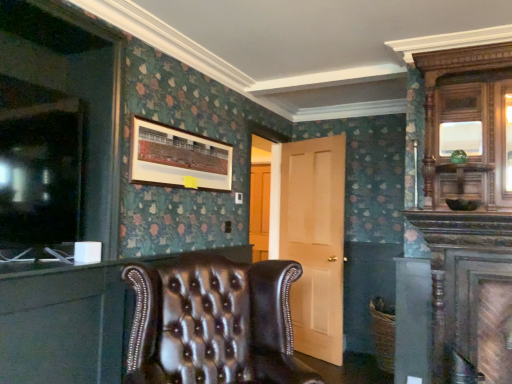
Question: Is the position of leather tufted chair at lower left less distant than that of leather tufted chair at center?

Choices:
 (A) no
 (B) yes

Answer: (A)

Question: Is leather tufted chair at lower left further to camera compared to leather tufted chair at center?

Choices:
 (A) yes
 (B) no

Answer: (A)

Question: Considering the relative sizes of leather tufted chair at lower left and leather tufted chair at center in the image provided, is leather tufted chair at lower left wider than leather tufted chair at center?

Choices:
 (A) yes
 (B) no

Answer: (B)

Question: Can you confirm if leather tufted chair at lower left is taller than leather tufted chair at center?

Choices:
 (A) yes
 (B) no

Answer: (B)

Question: Are leather tufted chair at lower left and leather tufted chair at center far apart?

Choices:
 (A) no
 (B) yes

Answer: (A)

Question: From a real-world perspective, is matte wooden picture frame at upper center above or below light wood door at center?

Choices:
 (A) below
 (B) above

Answer: (B)

Question: Is matte wooden picture frame at upper center inside the boundaries of light wood door at center, or outside?

Choices:
 (A) inside
 (B) outside

Answer: (B)

Question: Relative to light wood door at center, is matte wooden picture frame at upper center in front or behind?

Choices:
 (A) front
 (B) behind

Answer: (A)

Question: In terms of size, does matte wooden picture frame at upper center appear bigger or smaller than light wood door at center?

Choices:
 (A) small
 (B) big

Answer: (A)

Question: From a real-world perspective, is polished wood armoire at upper right physically located above or below leather tufted chair at center?

Choices:
 (A) below
 (B) above

Answer: (B)

Question: Considering the positions of polished wood armoire at upper right and leather tufted chair at center in the image, is polished wood armoire at upper right taller or shorter than leather tufted chair at center?

Choices:
 (A) short
 (B) tall

Answer: (B)

Question: From the image's perspective, is polished wood armoire at upper right located above or below leather tufted chair at center?

Choices:
 (A) above
 (B) below

Answer: (A)

Question: Would you say polished wood armoire at upper right is to the left or to the right of leather tufted chair at center in the picture?

Choices:
 (A) left
 (B) right

Answer: (B)

Question: Do you think matte wooden picture frame at upper center is within leather tufted chair at lower left, or outside of it?

Choices:
 (A) inside
 (B) outside

Answer: (B)

Question: Is matte wooden picture frame at upper center taller or shorter than leather tufted chair at lower left?

Choices:
 (A) tall
 (B) short

Answer: (B)